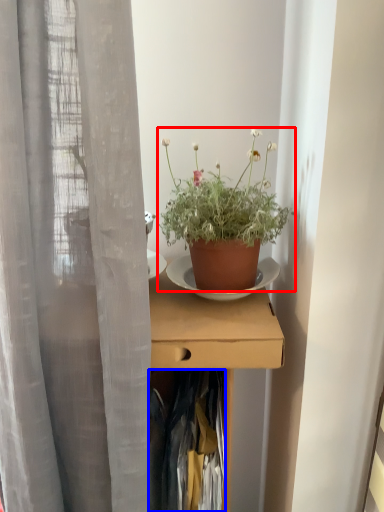
Question: Which of the following is the farthest to the observer, houseplant (highlighted by a red box) or clothing (highlighted by a blue box)?

Choices:
 (A) houseplant
 (B) clothing

Answer: (B)